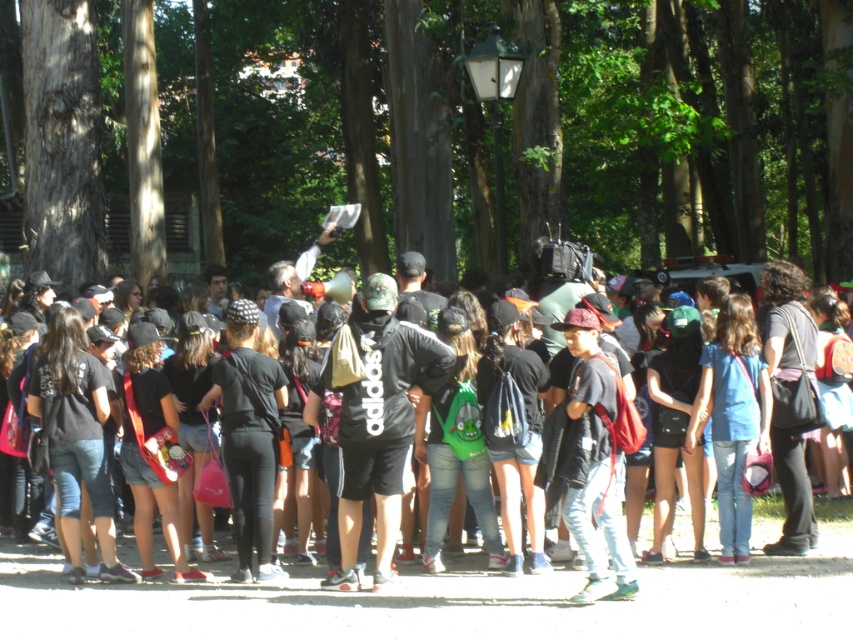
You are planning to hang a large banner between two trees in the park. The banner requires that the tree it is hung on must be larger in size than the other. Which tree should you choose between the brown textured tree at upper center and the smooth brown tree trunk at left?

The brown textured tree at upper center is bigger than the smooth brown tree trunk at left, so you should choose the brown textured tree at upper center to hang the banner as it meets the size requirement.

You are standing at point (71, 88) and want to walk to point (683, 108). Given the park layout described, will you be moving towards the trees or away from them?

Since point (683, 108) is behind point (71, 88), you will be moving away from the trees as you walk towards it.